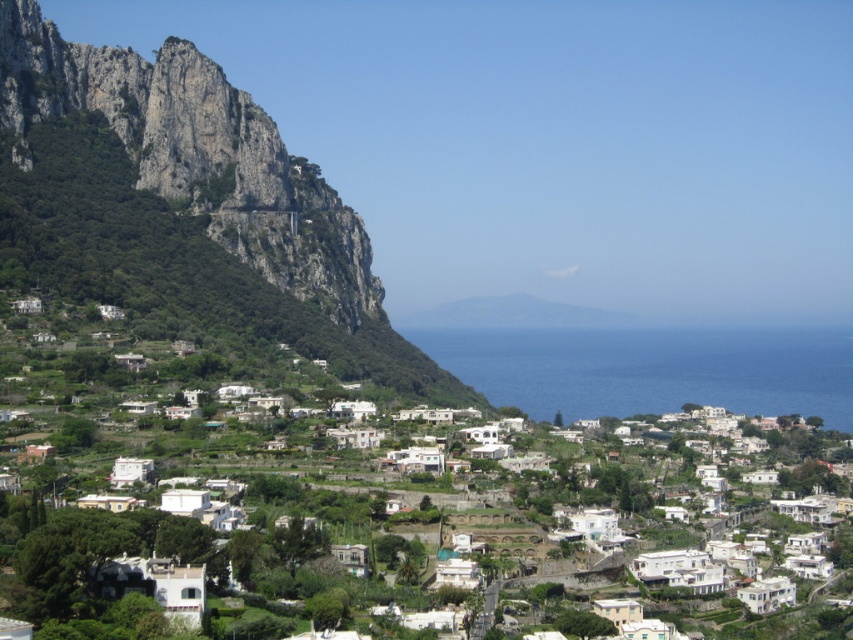
You are a hiker standing at the base of the rugged stone mountain at left and want to reach the blue liquid water at center. Which direction should you move to get there?

The rugged stone mountain at left is located above the blue liquid water at center, so you should move downward towards the blue liquid water at center to reach it.

You are a hiker planning to climb the rugged stone mountain at left and then descend to the blue liquid water at center. Based on the scene, which part of the journey will require more effort due to elevation changes?

The rugged stone mountain at left has a greater height compared to blue liquid water at center, so climbing the rugged stone mountain at left will require more effort due to elevation changes.